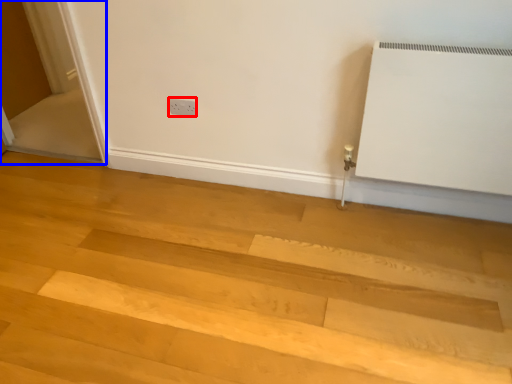
Question: Among these objects, which one is nearest to the camera, electric outlet (highlighted by a red box) or screen door (highlighted by a blue box)?

Choices:
 (A) electric outlet
 (B) screen door

Answer: (B)